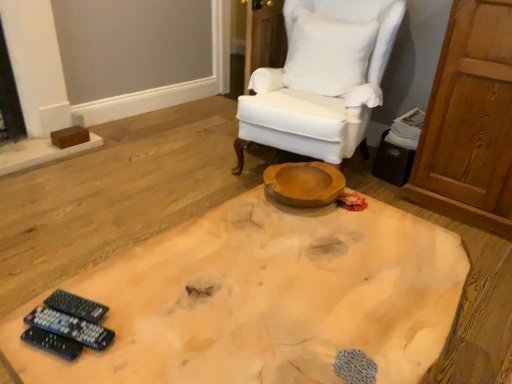
Where is `free space behind black plastic remote controls at lower left, the 2th remote control viewed from the back`? The height and width of the screenshot is (384, 512). free space behind black plastic remote controls at lower left, the 2th remote control viewed from the back is located at coordinates (115, 275).